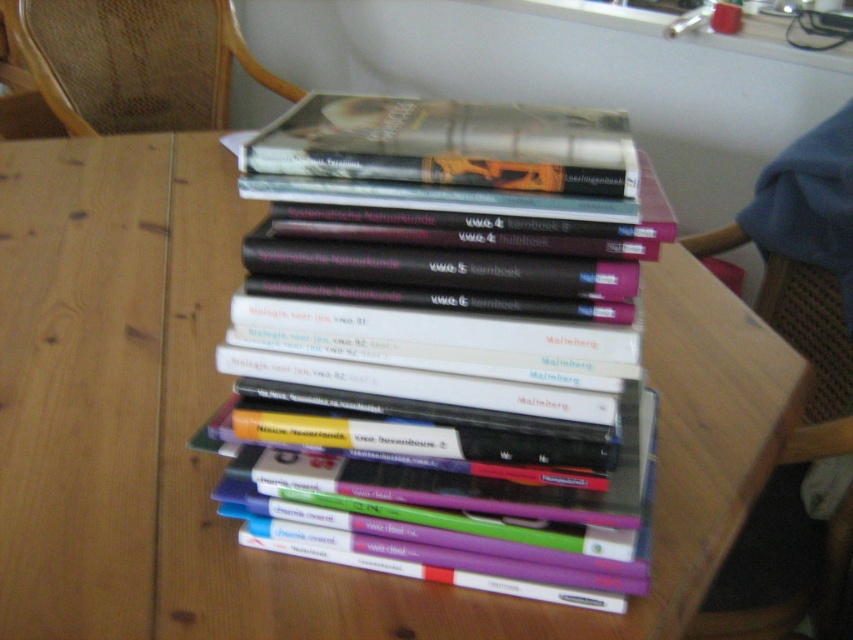
Is hardcover book at center below woven cane chair at upper left?

Correct, hardcover book at center is located below woven cane chair at upper left.

Is point (503, 316) farther from viewer compared to point (173, 80)?

No, it is in front of (173, 80).

Find the location of a particular element. The image size is (853, 640). hardcover book at center is located at coordinates (444, 397).

Locate an element on the screen. This screenshot has width=853, height=640. hardcover book at center is located at coordinates (444, 397).